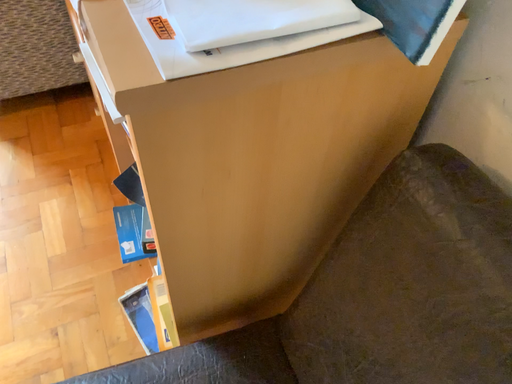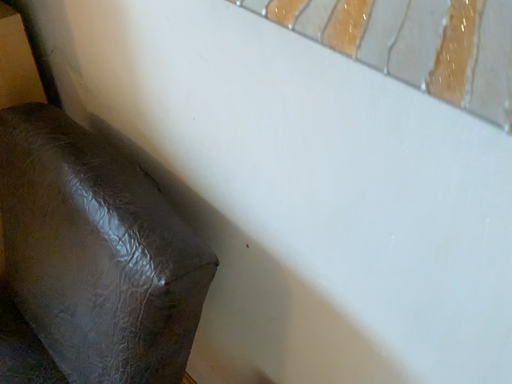
Question: How did the camera likely rotate when shooting the video?

Choices:
 (A) rotated upward
 (B) rotated downward

Answer: (A)